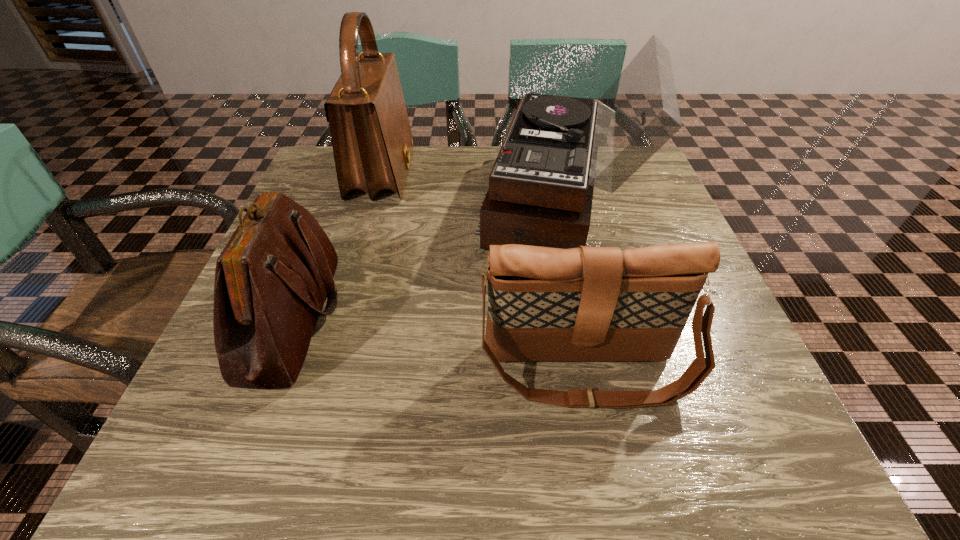
The width and height of the screenshot is (960, 540). Find the location of `unoccupied position between the farthest shoulder bag and the record player`. unoccupied position between the farthest shoulder bag and the record player is located at coordinates (472, 188).

Locate which object ranks in proximity to the record player. Please provide its 2D coordinates. Your answer should be formatted as a tuple, i.e. [(x, y)], where the tuple contains the x and y coordinates of a point satisfying the conditions above.

[(372, 142)]

Point out which object is positioned as the second nearest to the tallest shoulder bag. Please provide its 2D coordinates. Your answer should be formatted as a tuple, i.e. [(x, y)], where the tuple contains the x and y coordinates of a point satisfying the conditions above.

[(557, 149)]

Identify which shoulder bag is the second nearest to the record player. Please provide its 2D coordinates. Your answer should be formatted as a tuple, i.e. [(x, y)], where the tuple contains the x and y coordinates of a point satisfying the conditions above.

[(586, 303)]

Identify which shoulder bag is the closest to the record player. Please provide its 2D coordinates. Your answer should be formatted as a tuple, i.e. [(x, y)], where the tuple contains the x and y coordinates of a point satisfying the conditions above.

[(372, 142)]

Locate an element on the screen. This screenshot has width=960, height=540. vacant region that satisfies the following two spatial constraints: 1. on the front flap of the record player; 2. on the left side of the farthest shoulder bag is located at coordinates (374, 202).

This screenshot has width=960, height=540. What are the coordinates of `vacant space that satisfies the following two spatial constraints: 1. on the front flap of the farthest shoulder bag; 2. on the back side of the record player` in the screenshot? It's located at (374, 202).